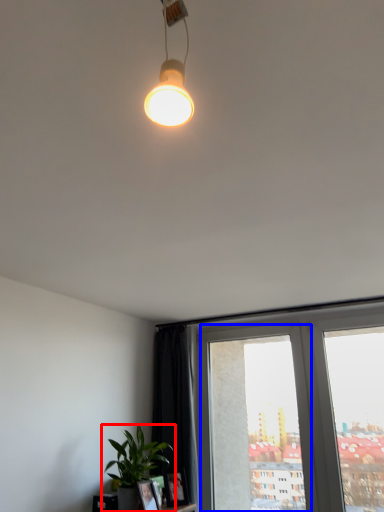
Question: Which point is further to the camera, houseplant (highlighted by a red box) or window frame (highlighted by a blue box)?

Choices:
 (A) houseplant
 (B) window frame

Answer: (B)